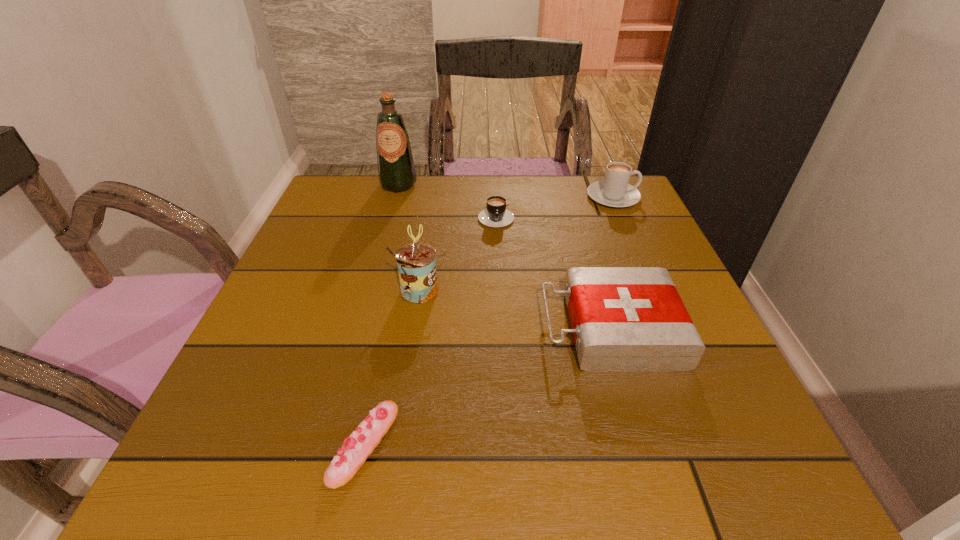
You are a GUI agent. You are given a task and a screenshot of the screen. Output one action in this format:
    pyautogui.click(x=<x>, y=<y>)
    Task: Click on the olive oil
    This screenshot has height=540, width=960.
    Given the screenshot: What is the action you would take?
    pyautogui.click(x=396, y=171)

You are a GUI agent. You are given a task and a screenshot of the screen. Output one action in this format:
    pyautogui.click(x=<x>, y=<y>)
    Task: Click on the can
    The width and height of the screenshot is (960, 540).
    Given the screenshot: What is the action you would take?
    pyautogui.click(x=416, y=263)

Image resolution: width=960 pixels, height=540 pixels. In order to click on the fourth shortest object in this screenshot , I will do `click(614, 191)`.

The image size is (960, 540). Find the location of `the right cappuccino`. the right cappuccino is located at coordinates (614, 191).

What are the coordinates of `the first-aid kit` in the screenshot? It's located at (624, 319).

Locate an element on the screen. The width and height of the screenshot is (960, 540). the shorter cappuccino is located at coordinates (496, 215).

The height and width of the screenshot is (540, 960). Find the location of `the fourth object from left to right`. the fourth object from left to right is located at coordinates (496, 215).

This screenshot has height=540, width=960. In order to click on the nearest object in this screenshot , I will do `click(356, 448)`.

At what (x,y) coordinates should I click in order to perform the action: click on eclair. Please return your answer as a coordinate pair (x, y). This screenshot has width=960, height=540. Looking at the image, I should click on (356, 448).

The width and height of the screenshot is (960, 540). I want to click on free point located on the front-facing side of the olive oil, so click(372, 276).